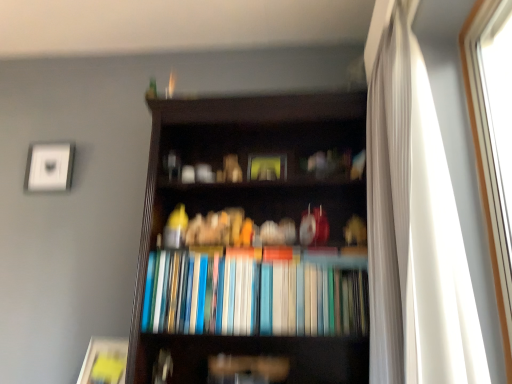
Question: Relative to hardcover books at center, is white sheer curtain at right in front or behind?

Choices:
 (A) front
 (B) behind

Answer: (A)

Question: From the image's perspective, is white sheer curtain at right located above or below hardcover books at center?

Choices:
 (A) below
 (B) above

Answer: (B)

Question: Estimate the real-world distances between objects in this image. Which object is closer to the white sheer curtain at right?

Choices:
 (A) matte yellow paperback book at lower left
 (B) white glass window at right
 (C) matte white picture frame at upper left
 (D) dark wood bookcase at center
 (E) hardcover books at center

Answer: (B)

Question: Based on their relative distances, which object is nearer to the matte white picture frame at upper left?

Choices:
 (A) matte yellow paperback book at lower left
 (B) white sheer curtain at right
 (C) dark wood bookcase at center
 (D) white glass window at right
 (E) hardcover books at center

Answer: (C)